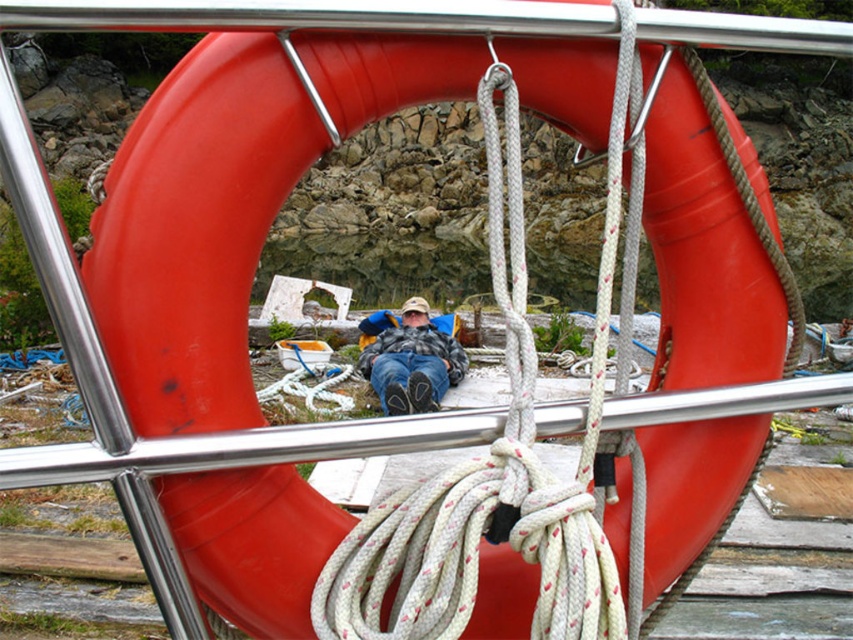
Question: Which of the following is the farthest from the observer?

Choices:
 (A) white textured rope at center
 (B) flannel shirt at center

Answer: (B)

Question: Is white textured rope at center below flannel shirt at center?

Choices:
 (A) no
 (B) yes

Answer: (A)

Question: Does white textured rope at center have a greater width compared to flannel shirt at center?

Choices:
 (A) yes
 (B) no

Answer: (B)

Question: Which point appears closest to the camera in this image?

Choices:
 (A) (611, 252)
 (B) (418, 342)

Answer: (A)

Question: Is white textured rope at center above flannel shirt at center?

Choices:
 (A) yes
 (B) no

Answer: (A)